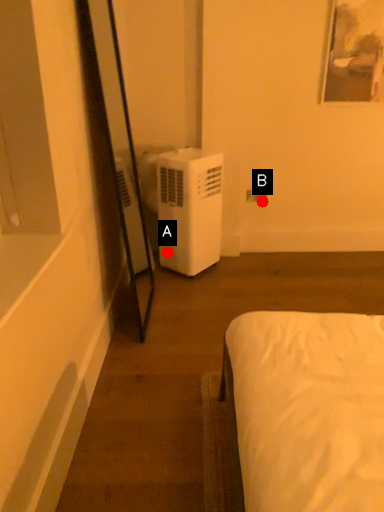
Question: Two points are circled on the image, labeled by A and B beside each circle. Which point is farther from the camera taking this photo?

Choices:
 (A) A is further
 (B) B is further

Answer: (B)